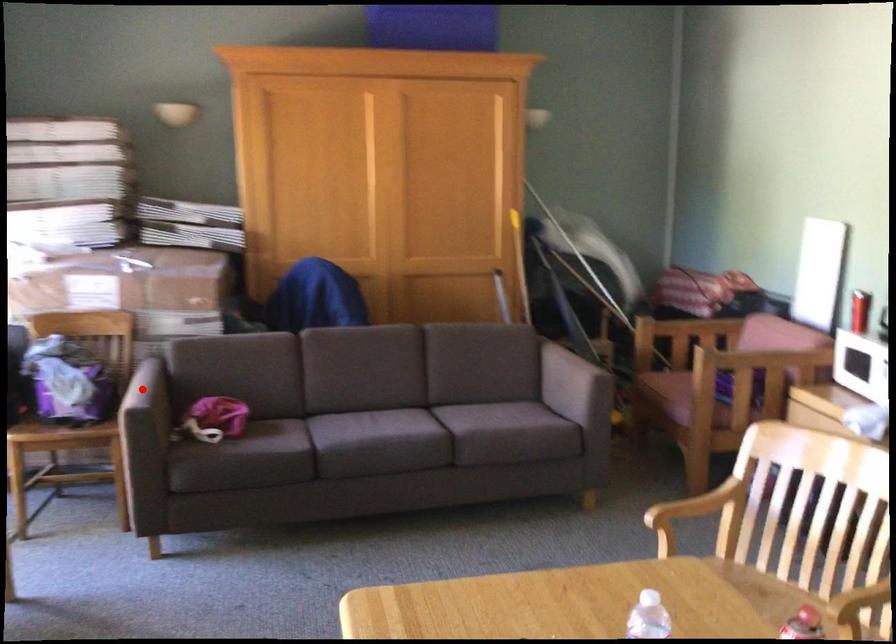
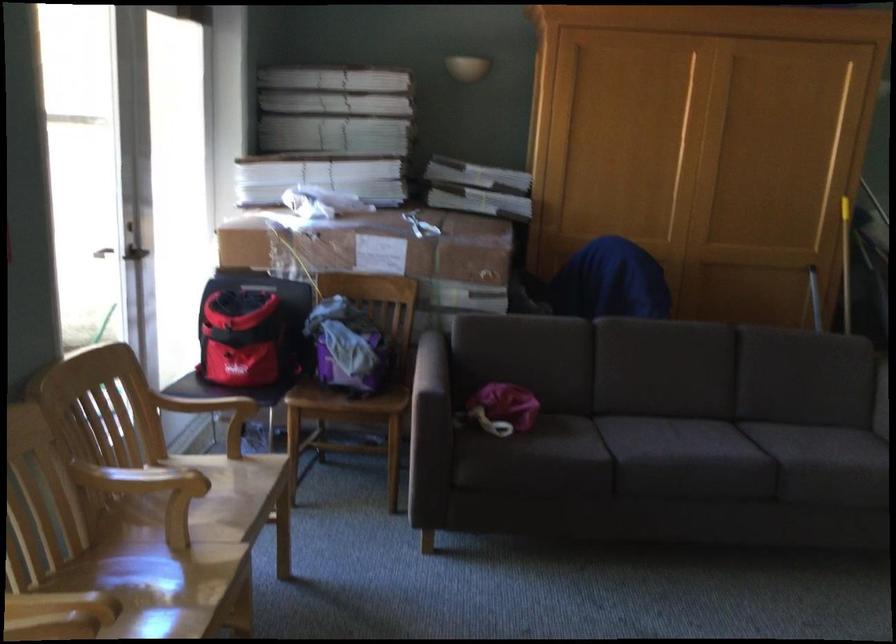
Question: A red point is marked in image1. In image2, is the corresponding 3D point closer to the camera or farther? Reply with the corresponding letter.

Choices:
 (A) The corresponding 3D point is closer.
 (B) The corresponding 3D point is farther.

Answer: (A)